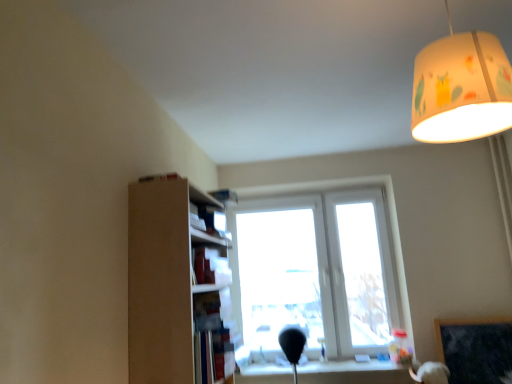
Question: Visually, is transparent glass window at center positioned to the left or to the right of brown cardboard shelf at left?

Choices:
 (A) left
 (B) right

Answer: (B)

Question: Considering the positions of transparent glass window at center and brown cardboard shelf at left in the image, is transparent glass window at center bigger or smaller than brown cardboard shelf at left?

Choices:
 (A) big
 (B) small

Answer: (A)

Question: Estimate the real-world distances between objects in this image. Which object is farther from the dark gray matte bulletin board at lower right?

Choices:
 (A) brown cardboard shelf at left
 (B) hardcover book at upper center
 (C) transparent glass window at center
 (D) white fabric lampshade at upper right

Answer: (D)

Question: Which object is positioned closest to the brown cardboard shelf at left?

Choices:
 (A) white fabric lampshade at upper right
 (B) hardcover book at upper center
 (C) transparent glass window at center
 (D) dark gray matte bulletin board at lower right

Answer: (B)